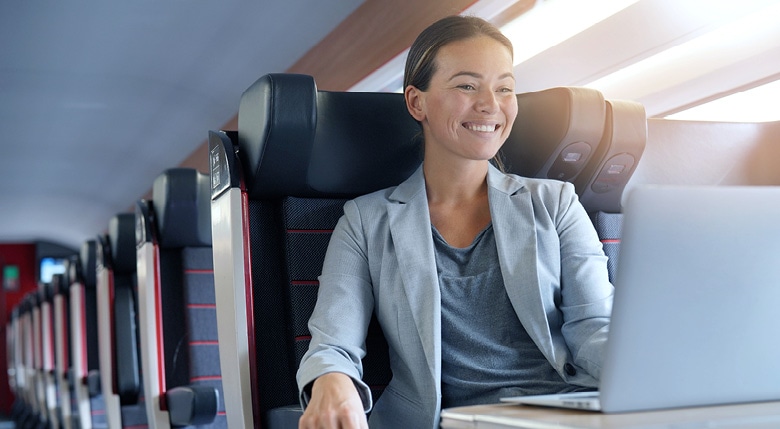
Identify the location of computer. (636, 382).